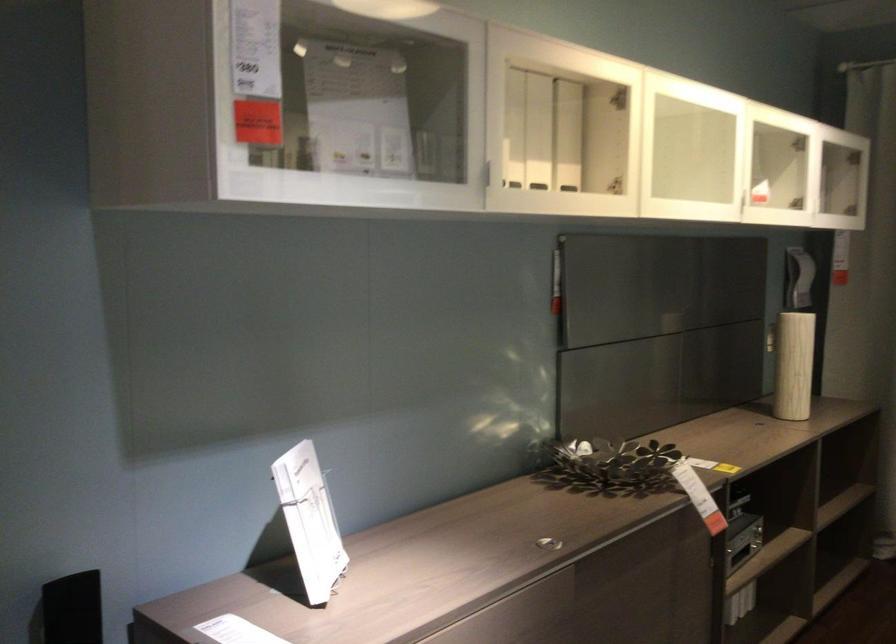
Image resolution: width=896 pixels, height=644 pixels. What do you see at coordinates (794, 365) in the screenshot?
I see `the cylindrical white vase` at bounding box center [794, 365].